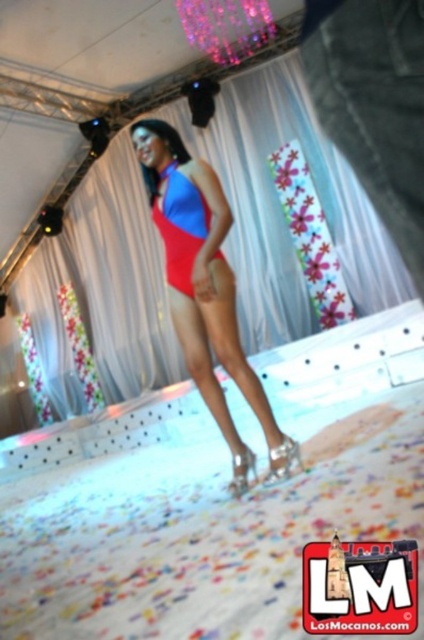
Question: Which object appears closest to the camera in this image?

Choices:
 (A) matte red swimsuit at center
 (B) matte red swimsuit at upper center
 (C) white sheer curtain at center
 (D) matte blue bikini top at center

Answer: (B)

Question: Which object is closer to the camera taking this photo?

Choices:
 (A) white sheer curtain at center
 (B) matte blue bikini top at center

Answer: (B)

Question: Considering the relative positions of matte red swimsuit at center and matte blue bikini top at center in the image provided, where is matte red swimsuit at center located with respect to matte blue bikini top at center?

Choices:
 (A) left
 (B) right

Answer: (B)

Question: Is matte red swimsuit at center thinner than matte blue bikini top at center?

Choices:
 (A) yes
 (B) no

Answer: (B)

Question: Does matte red swimsuit at center lie in front of matte blue bikini top at center?

Choices:
 (A) no
 (B) yes

Answer: (B)

Question: Estimate the real-world distances between objects in this image. Which object is closer to the white sheer curtain at center?

Choices:
 (A) matte red swimsuit at center
 (B) matte red swimsuit at upper center
 (C) matte blue bikini top at center

Answer: (A)